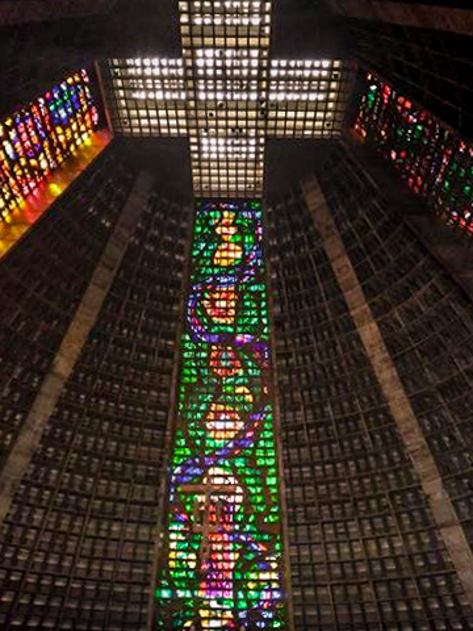
This screenshot has width=473, height=631. What are the coordinates of `skylight` in the screenshot? It's located at (223, 105), (229, 154), (229, 20), (164, 102), (293, 98).